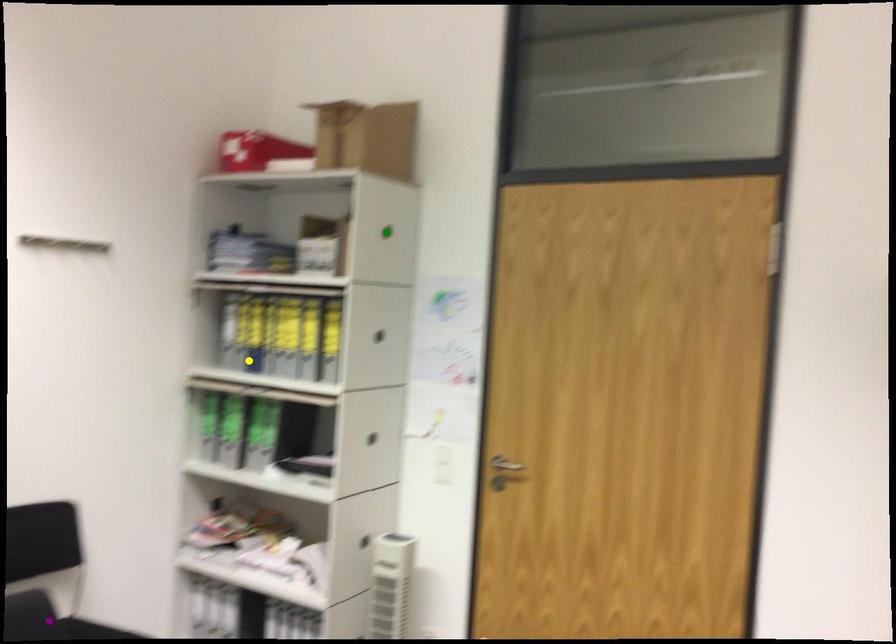
Based on the photo, order these from nearest to farthest:
yellow point | green point | purple point

purple point
green point
yellow point